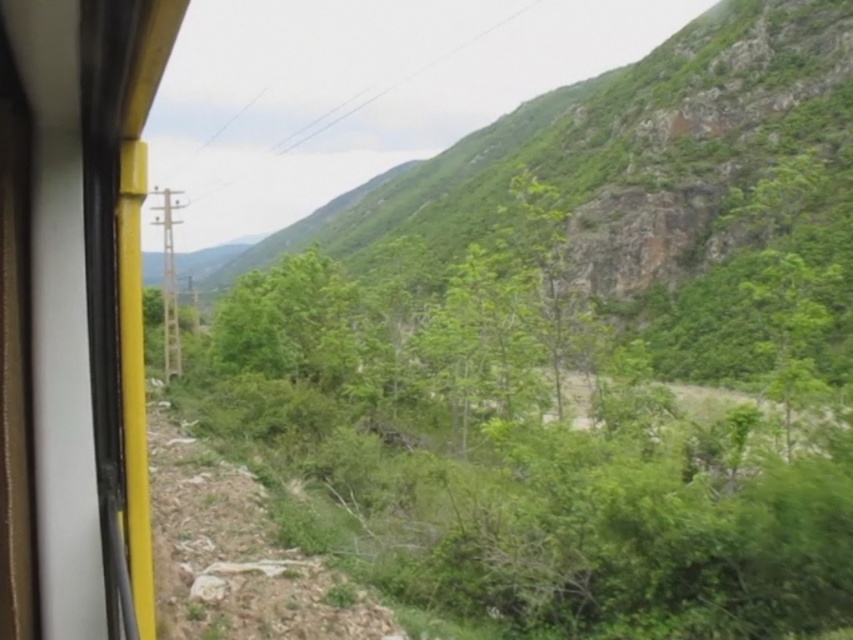
Question: Among these objects, which one is farthest from the camera?

Choices:
 (A) green leafy hillside at center
 (B) matte yellow train window at left
 (C) green leafy shrubs at center

Answer: (A)

Question: Which object is positioned farthest from the green leafy shrubs at center?

Choices:
 (A) green leafy hillside at center
 (B) matte yellow train window at left

Answer: (A)

Question: Estimate the real-world distances between objects in this image. Which object is closer to the matte yellow train window at left?

Choices:
 (A) green leafy hillside at center
 (B) green leafy shrubs at center

Answer: (B)

Question: Is the position of green leafy shrubs at center more distant than that of matte yellow train window at left?

Choices:
 (A) yes
 (B) no

Answer: (A)

Question: Does green leafy shrubs at center appear under green leafy hillside at center?

Choices:
 (A) yes
 (B) no

Answer: (A)

Question: Is green leafy shrubs at center thinner than green leafy hillside at center?

Choices:
 (A) no
 (B) yes

Answer: (B)